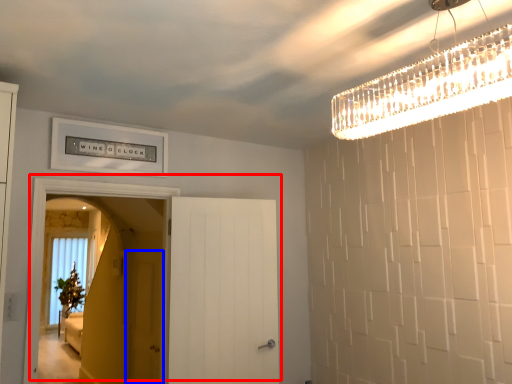
Question: Which object is further to the camera taking this photo, door (highlighted by a red box) or screen door (highlighted by a blue box)?

Choices:
 (A) door
 (B) screen door

Answer: (B)